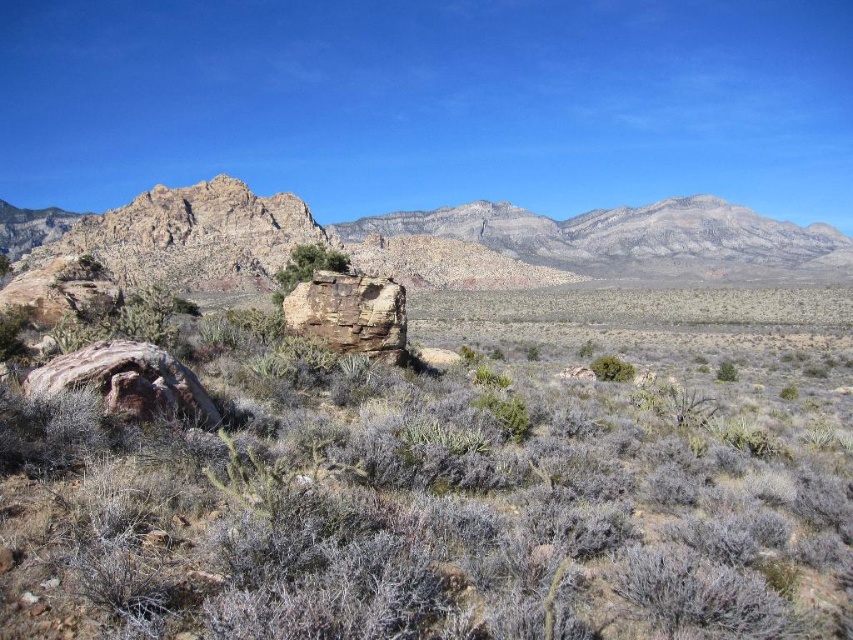
You are a geologist examining the desert scene. You notice two objects labeled as the rusty rock at center and the rusty rock formation at center. Which of these two has a greater width?

The rusty rock at center has a greater width than the rusty rock formation at center.

Based on the scene description, where is the green leafy shrub at center located in the image?

The green leafy shrub at center is located at the 2D coordinates point [306,266].

You are a geologist examining the desert landscape. You notice two objects of interest labeled as the rusty rock at center and the rusty rock formation at center. Which of these two objects is taller?

The rusty rock at center is taller than the rusty rock formation at center.